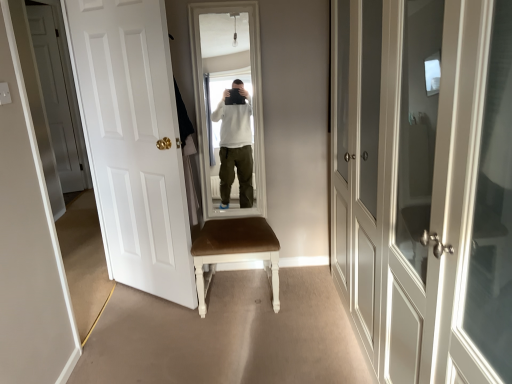
The width and height of the screenshot is (512, 384). In order to click on vacant space underneath brown leather chair at center (from a real-world perspective) in this screenshot , I will do 245,291.